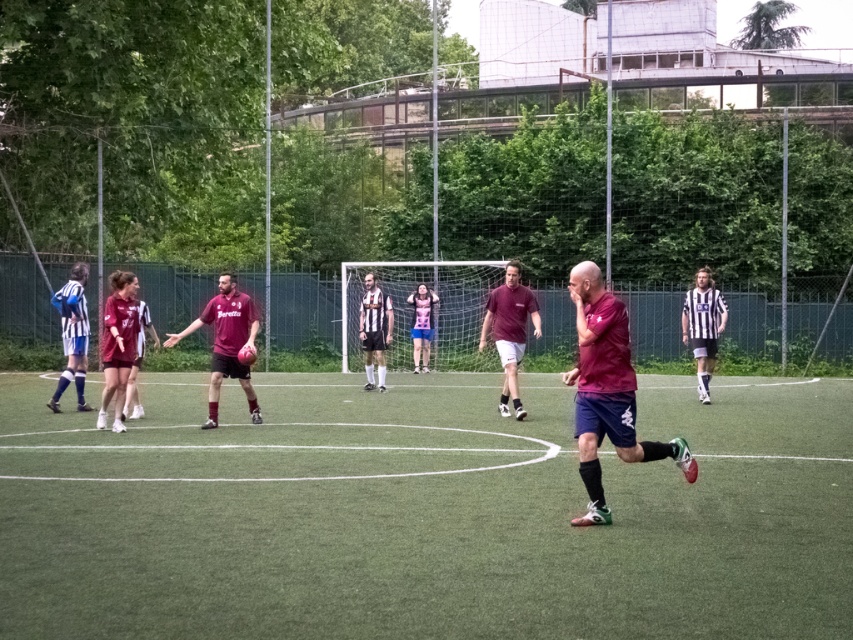
Can you confirm if matte maroon jersey at center is wider than striped jersey at right?

Yes.

Which is behind, point (213, 388) or point (683, 317)?

The point (683, 317) is behind.

I want to click on matte maroon jersey at center, so click(225, 342).

Is green artificial turf at center above pink fabric shirt at center?

No, green artificial turf at center is not above pink fabric shirt at center.

Describe the element at coordinates (424, 515) in the screenshot. This screenshot has width=853, height=640. I see `green artificial turf at center` at that location.

The image size is (853, 640). In order to click on green artificial turf at center in this screenshot , I will do `click(424, 515)`.

Can you confirm if maroon jersey at center is shorter than matte maroon jersey at center?

Incorrect, maroon jersey at center's height does not fall short of matte maroon jersey at center's.

Is maroon jersey at center to the left of matte maroon jersey at center from the viewer's perspective?

In fact, maroon jersey at center is to the right of matte maroon jersey at center.

Where is `maroon jersey at center`? Image resolution: width=853 pixels, height=640 pixels. maroon jersey at center is located at coordinates (607, 390).